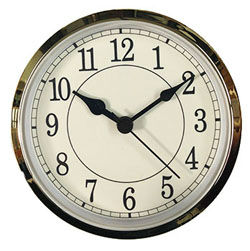
The image size is (250, 251). I want to click on clock, so click(x=163, y=138).